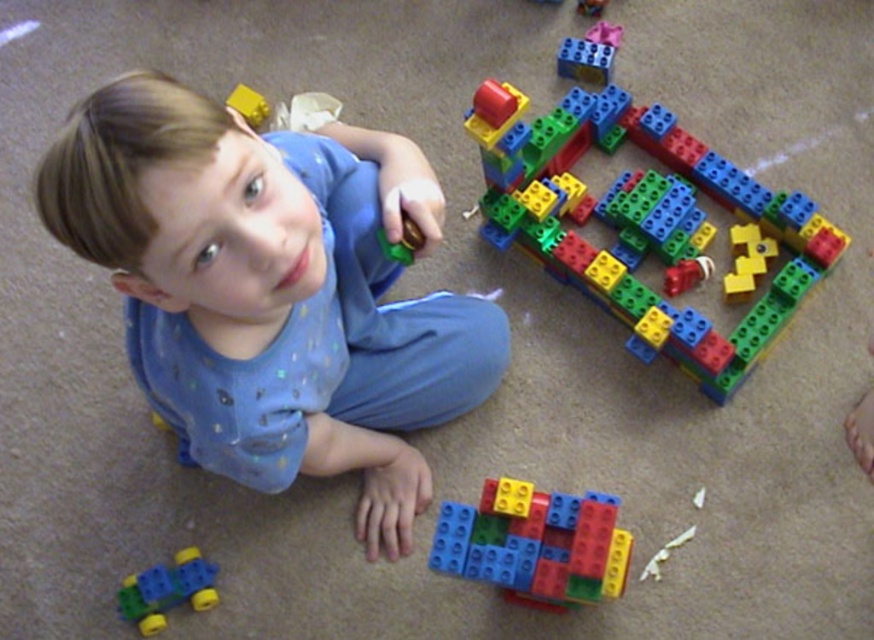
Question: Which point is farther to the camera?

Choices:
 (A) pos(172,572)
 (B) pos(333,180)
 (C) pos(592,112)

Answer: (C)

Question: Is blue cotton toddler at upper left closer to the viewer compared to green plastic toy car at lower left?

Choices:
 (A) yes
 (B) no

Answer: (A)

Question: Which point is farther to the camera?

Choices:
 (A) (479, 522)
 (B) (333, 196)
 (C) (170, 604)
 (D) (674, 204)

Answer: (D)

Question: Among these objects, which one is nearest to the camera?

Choices:
 (A) green plastic toy car at lower left
 (B) blue cotton toddler at upper left

Answer: (B)

Question: Is translucent plastic building blocks at center bigger than multicolored plastic blocks at center?

Choices:
 (A) yes
 (B) no

Answer: (A)

Question: Is blue cotton toddler at upper left thinner than green plastic toy car at lower left?

Choices:
 (A) no
 (B) yes

Answer: (A)